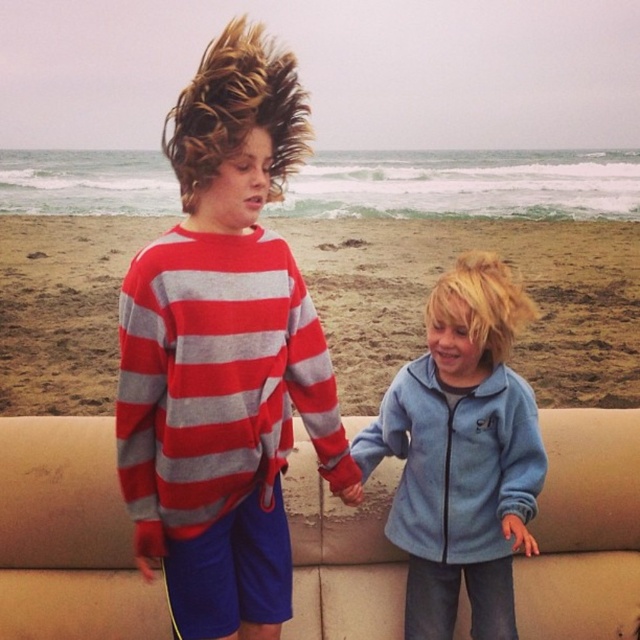
Question: Estimate the real-world distances between objects in this image. Which object is closer to the sandy beach at lower center?

Choices:
 (A) red and gray striped sweater at center
 (B) light blue fleece jacket at center
 (C) beige fabric couch at center

Answer: (B)

Question: Is red and gray striped sweater at center behind beige fabric couch at center?

Choices:
 (A) no
 (B) yes

Answer: (A)

Question: Is red and gray striped sweater at center positioned behind beige fabric couch at center?

Choices:
 (A) no
 (B) yes

Answer: (A)

Question: Which of the following is the farthest from the observer?

Choices:
 (A) red and gray striped sweater at center
 (B) sandy beach at lower center

Answer: (B)

Question: Which object is closer to the camera taking this photo?

Choices:
 (A) red and gray striped sweater at center
 (B) light blue fleece jacket at center
 (C) beige fabric couch at center

Answer: (A)

Question: Is sandy beach at lower center thinner than light blue fleece jacket at center?

Choices:
 (A) no
 (B) yes

Answer: (A)